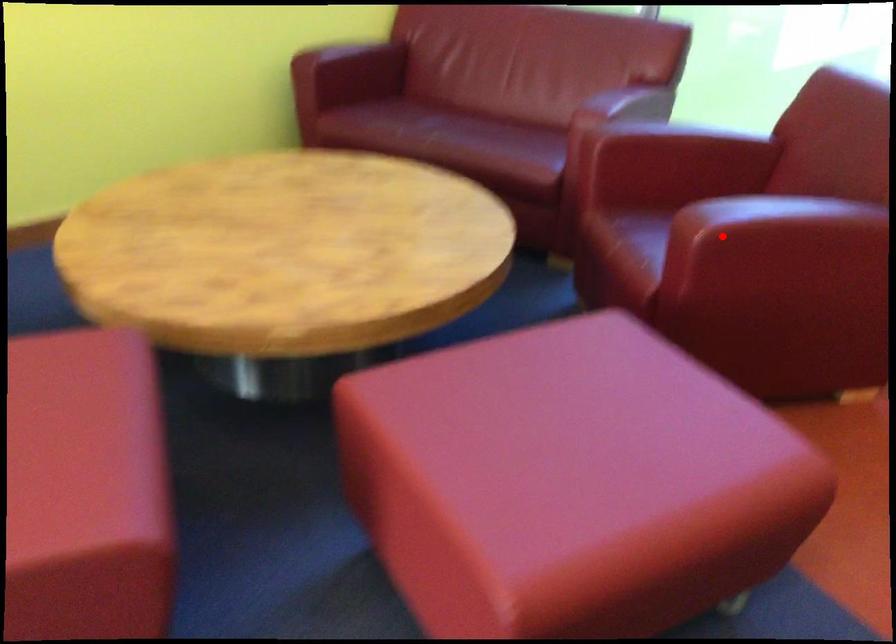
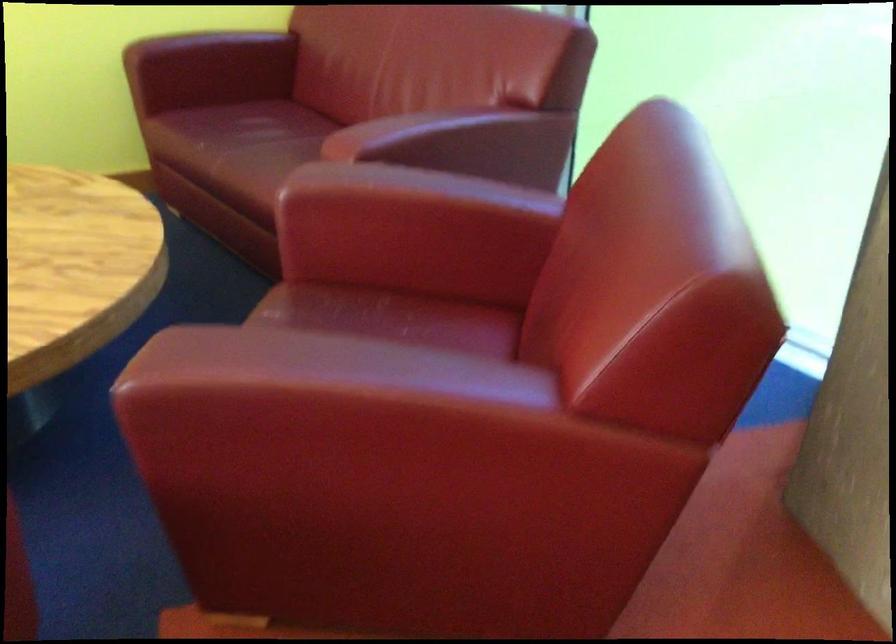
Question: I am providing you with two images of the same scene from different viewpoints. A red point is shown in image1. For the corresponding object point in image2, is it positioned nearer or farther from the camera?

Choices:
 (A) Nearer
 (B) Farther

Answer: (A)